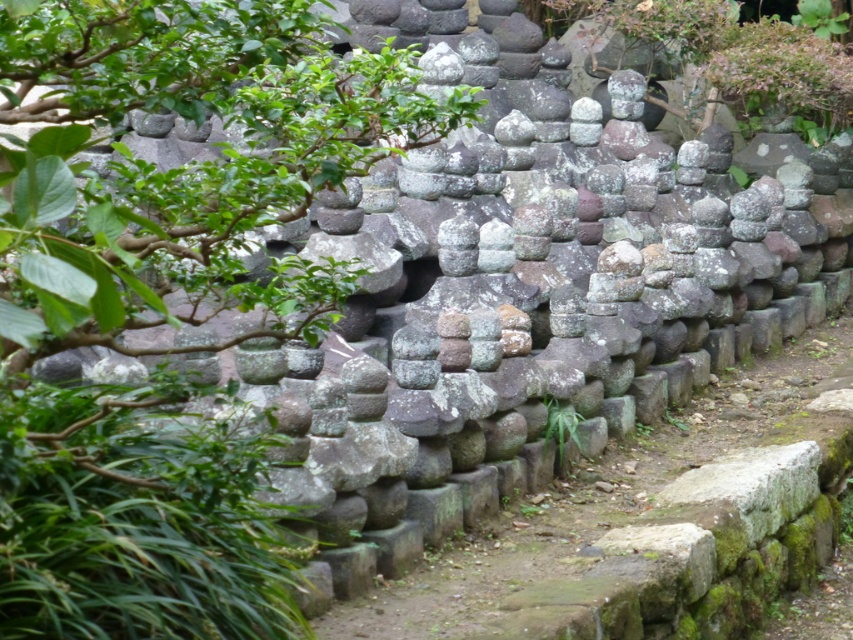
You are standing in front of the stone wall and want to place a small decoration. You have two points marked on the wall where you can place it. The points are labeled as point 1 at coordinates (437,129) and point 2 at coordinates (485,600). Which point is closer to you so that the decoration will be more visible?

Point 1 at coordinates (437,129) is closer to the viewer than point 2 at coordinates (485,600), so placing the decoration there will make it more visible.